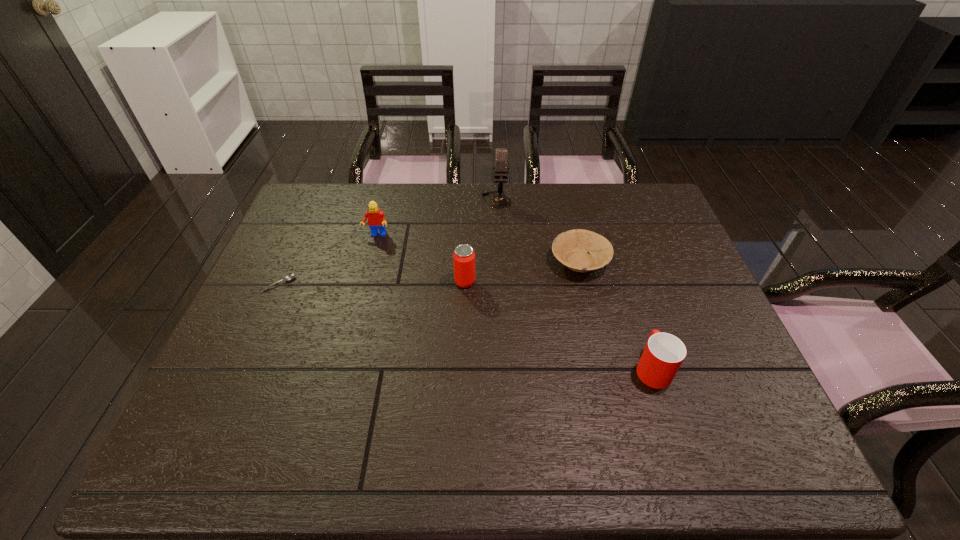
This screenshot has width=960, height=540. Identify the location of free space at the near edge of the desktop. (639, 434).

Where is `free point at the left edge`? Image resolution: width=960 pixels, height=540 pixels. free point at the left edge is located at coordinates (297, 325).

Locate an element on the screen. The height and width of the screenshot is (540, 960). vacant space at the right edge of the desktop is located at coordinates (678, 268).

In the image, there is a desktop. Where is `vacant space at the far left corner`? The width and height of the screenshot is (960, 540). vacant space at the far left corner is located at coordinates pos(335,208).

Image resolution: width=960 pixels, height=540 pixels. Find the location of `vacant area at the near left corner of the desktop`. vacant area at the near left corner of the desktop is located at coordinates coord(241,460).

In order to click on free space between the beer can and the bowl in this screenshot , I will do `click(522, 272)`.

This screenshot has height=540, width=960. Find the location of `vacant area between the third object from left to right and the bowl`. vacant area between the third object from left to right and the bowl is located at coordinates (522, 272).

Identify the location of vacant space that is in between the third object from left to right and the fifth nearest object. The width and height of the screenshot is (960, 540). (420, 259).

At what (x,y) coordinates should I click in order to perform the action: click on free space between the soupspoon and the beer can. Please return your answer as a coordinate pair (x, y). Looking at the image, I should click on (372, 283).

Where is `free spot between the bowl and the fifth nearest object`? This screenshot has width=960, height=540. free spot between the bowl and the fifth nearest object is located at coordinates (478, 248).